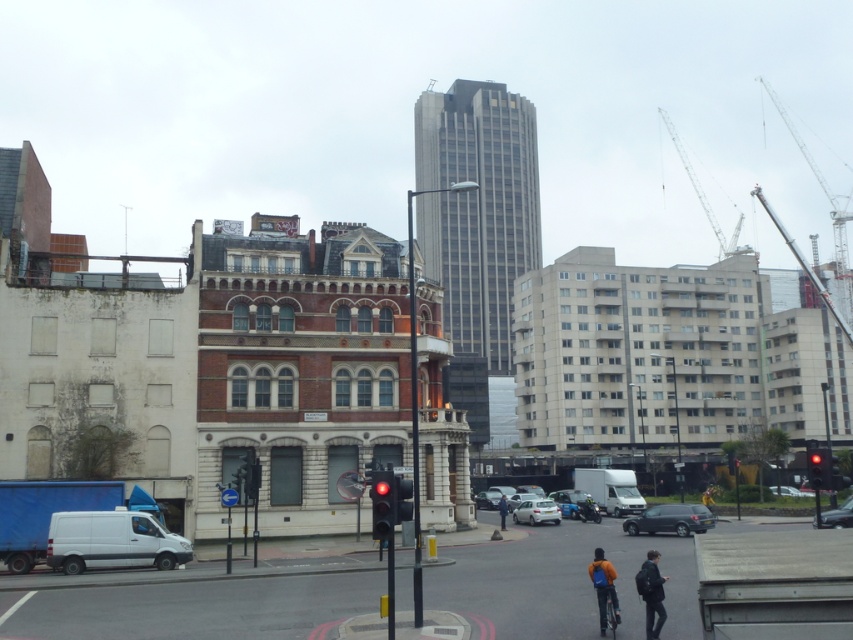
Question: Which object is positioned farthest from the red glass traffic light at right?

Choices:
 (A) silver metallic hatchback at center
 (B) metallic silver car at center

Answer: (A)

Question: Which of the following is the farthest from the observer?

Choices:
 (A) (791, 486)
 (B) (819, 486)

Answer: (A)

Question: Considering the relative positions of dark blue jacket at lower right and blue leather jacket at center in the image provided, where is dark blue jacket at lower right located with respect to blue leather jacket at center?

Choices:
 (A) above
 (B) below

Answer: (A)

Question: Which point is farther from the camera taking this photo?

Choices:
 (A) (646, 600)
 (B) (619, 620)
 (C) (548, 504)

Answer: (C)

Question: Can you confirm if dark blue jacket at lower right is positioned below metallic silver car at center?

Choices:
 (A) no
 (B) yes

Answer: (A)

Question: Can you confirm if matte black suv at center is thinner than blue leather jacket at center?

Choices:
 (A) no
 (B) yes

Answer: (A)